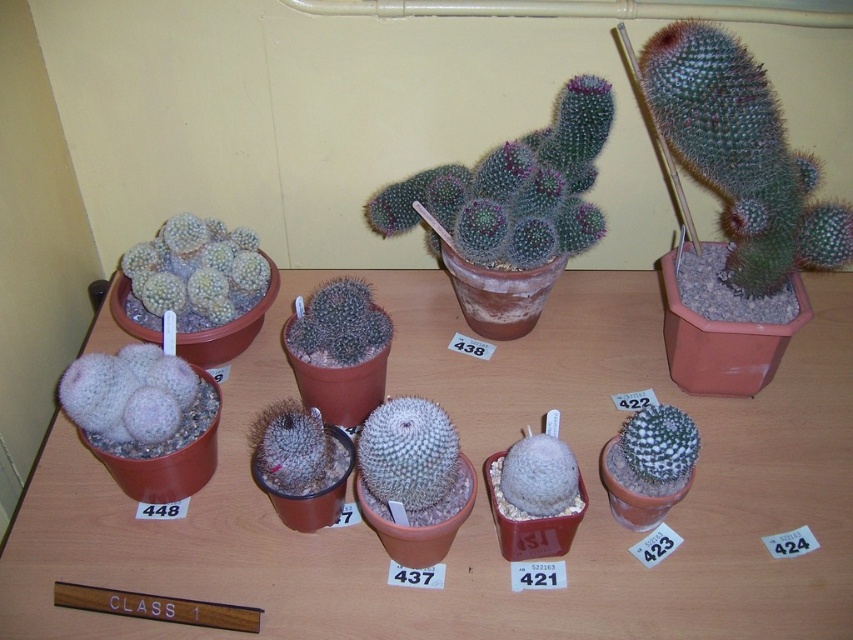
In the scene shown: You are a botanist examining the cacti on the wooden table. You need to locate the white fuzzy cactus at upper left and the green spiky cactus at center. Which cactus is located to the left of the other?

The white fuzzy cactus at upper left is positioned to the left of the green spiky cactus at center.

You are a gardener who needs to water the plants. The watering can you have can only reach 18 inches. You are standing at the succulent cactus at center. Can you reach the green spiky cactus at upper right with your watering can?

The distance between the green spiky cactus at upper right and the succulent cactus at center is 19.49 inches. Since the watering can can only reach 18 inches, you cannot reach the green spiky cactus at upper right from the succulent cactus at center.

You are standing in front of the cacti display. You notice two points marked on the image. The first point is at coordinates point (685, 106) and the second is at point (363, 337). Which of these points is nearer to you?

Point (685, 106) is closer to the viewer than point (363, 337).